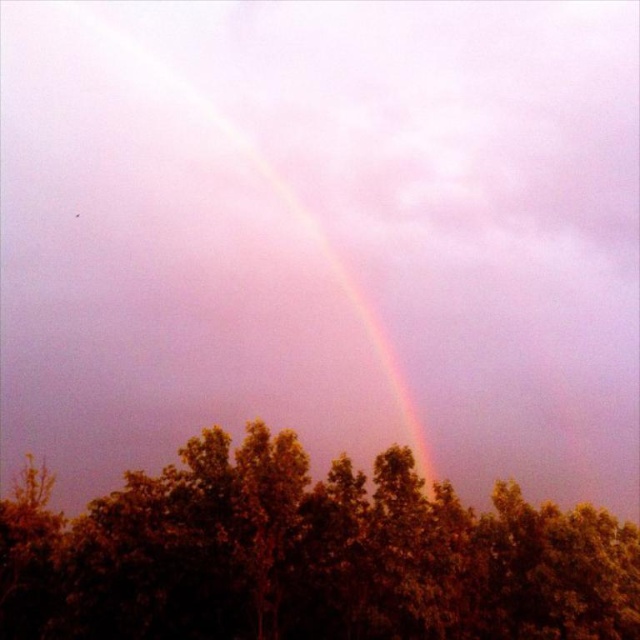
Question: Is green leafy tree at center positioned behind rainbow at upper center?

Choices:
 (A) yes
 (B) no

Answer: (B)

Question: Among these objects, which one is nearest to the camera?

Choices:
 (A) green leafy tree at center
 (B) rainbow at upper center

Answer: (A)

Question: Is green leafy tree at center to the left of rainbow at upper center from the viewer's perspective?

Choices:
 (A) yes
 (B) no

Answer: (B)

Question: Is green leafy tree at center below rainbow at upper center?

Choices:
 (A) no
 (B) yes

Answer: (B)

Question: Among these points, which one is nearest to the camera?

Choices:
 (A) (172, 67)
 (B) (330, 584)

Answer: (B)